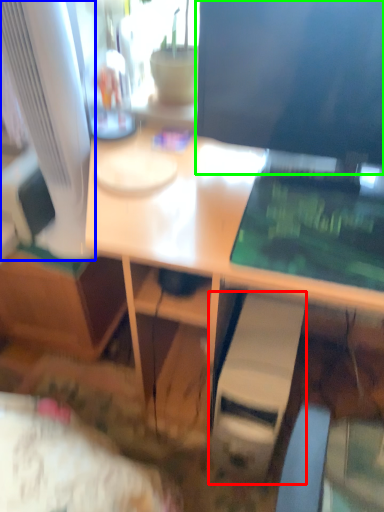
Question: Which object is positioned farthest from computer tower (highlighted by a red box)? Select from computer monitor (highlighted by a blue box) and computer monitor (highlighted by a green box).

Choices:
 (A) computer monitor
 (B) computer monitor

Answer: (A)